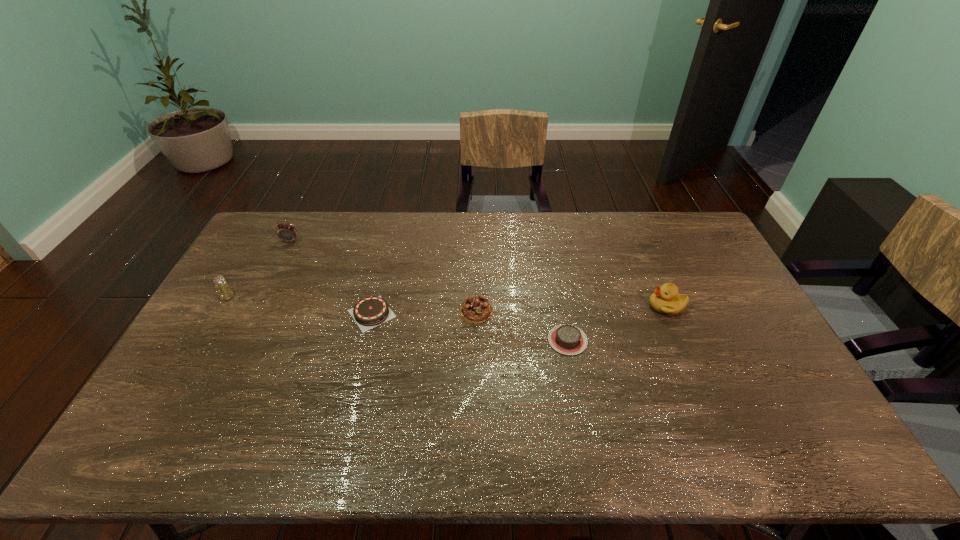
At what (x,y) coordinates should I click in order to perform the action: click on alarm clock. Please return your answer as a coordinate pair (x, y). The width and height of the screenshot is (960, 540). Looking at the image, I should click on (286, 232).

Locate an element on the screen. the fifth object from right to left is located at coordinates (286, 232).

This screenshot has height=540, width=960. In order to click on duckling in this screenshot , I will do `click(666, 300)`.

Locate an element on the screen. saltshaker is located at coordinates 225,292.

Find the location of a particular element. Image resolution: width=960 pixels, height=540 pixels. the fourth tallest object is located at coordinates (476, 309).

You are a GUI agent. You are given a task and a screenshot of the screen. Output one action in this format:
    pyautogui.click(x=<x>, y=<y>)
    Task: Click on the tallest chocolate cake
    The height and width of the screenshot is (540, 960).
    Given the screenshot: What is the action you would take?
    pyautogui.click(x=476, y=309)

Where is `the second shortest chocolate cake`? This screenshot has width=960, height=540. the second shortest chocolate cake is located at coordinates [369, 312].

The image size is (960, 540). I want to click on the fourth object from right to left, so click(x=369, y=312).

Identify the location of the rightmost chocolate cake. The width and height of the screenshot is (960, 540). (567, 339).

Find the location of a particular element. the fifth object from left to right is located at coordinates (567, 339).